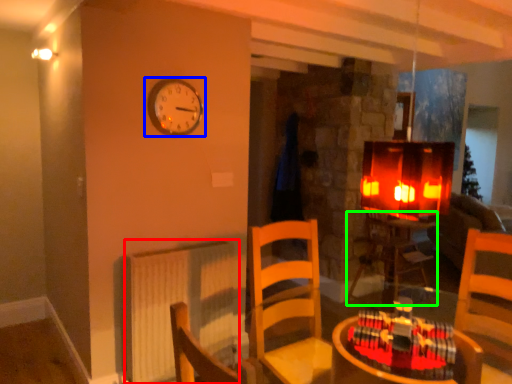
Question: Estimate the real-world distances between objects in this image. Which object is closer to radiator (highlighted by a red box), wall clock (highlighted by a blue box) or table (highlighted by a green box)?

Choices:
 (A) wall clock
 (B) table

Answer: (A)